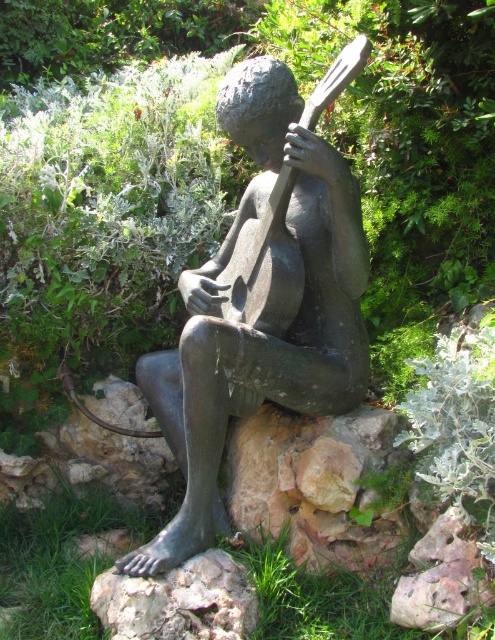
Question: Which object appears closest to the camera in this image?

Choices:
 (A) bronze guitar at center
 (B) bronze statue at center

Answer: (A)

Question: Which point is farther from the camera taking this photo?

Choices:
 (A) (218, 276)
 (B) (218, 420)

Answer: (A)

Question: Which point is closer to the camera?

Choices:
 (A) (289, 253)
 (B) (181, 634)

Answer: (B)

Question: Can you confirm if gray stone at lower center is bigger than bronze guitar at center?

Choices:
 (A) no
 (B) yes

Answer: (A)

Question: Does bronze statue at center appear on the right side of gray stone at lower center?

Choices:
 (A) yes
 (B) no

Answer: (A)

Question: Is bronze statue at center below gray stone at lower center?

Choices:
 (A) yes
 (B) no

Answer: (B)